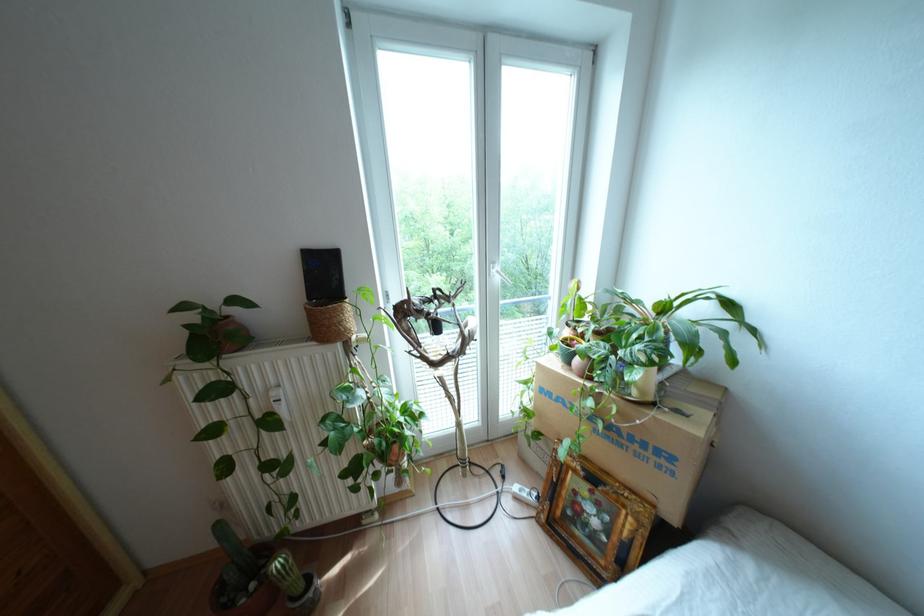
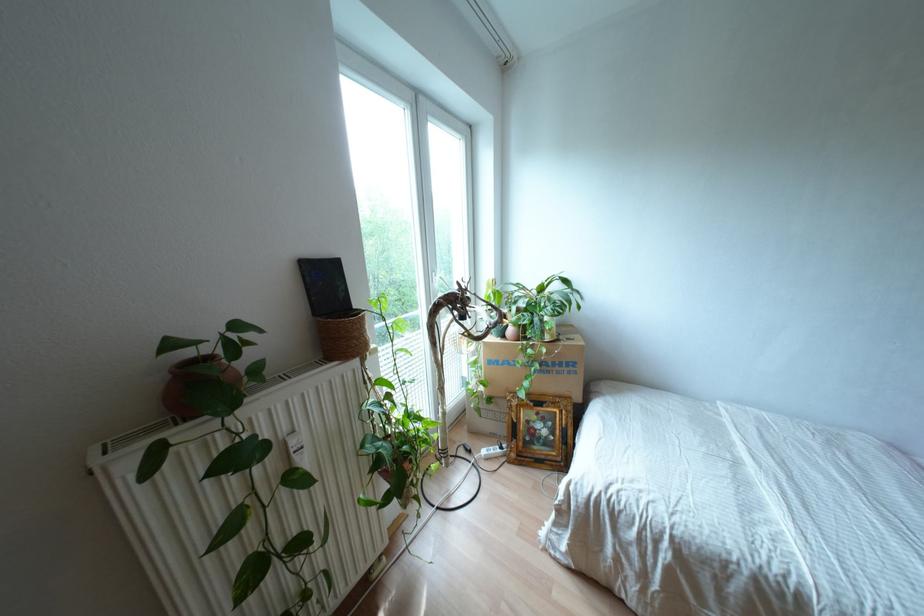
Locate, in the second image, the point that corresponds to point 576,360 in the first image.

(509, 330)